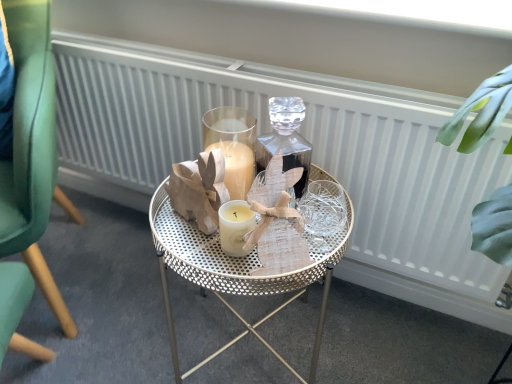
Question: Can you confirm if metallic gold table at center is thinner than green velvet chair at left?

Choices:
 (A) yes
 (B) no

Answer: (A)

Question: Is metallic gold table at center in front of green velvet chair at left?

Choices:
 (A) yes
 (B) no

Answer: (B)

Question: From the image's perspective, is metallic gold table at center below green velvet chair at left?

Choices:
 (A) no
 (B) yes

Answer: (B)

Question: Is metallic gold table at center with green velvet chair at left?

Choices:
 (A) no
 (B) yes

Answer: (A)

Question: Can we say metallic gold table at center lies outside green velvet chair at left?

Choices:
 (A) no
 (B) yes

Answer: (B)

Question: Considering the relative sizes of metallic gold table at center and green velvet chair at left in the image provided, is metallic gold table at center shorter than green velvet chair at left?

Choices:
 (A) no
 (B) yes

Answer: (B)

Question: Is green velvet chair at left shorter than white textured radiator at center?

Choices:
 (A) yes
 (B) no

Answer: (B)

Question: From the image's perspective, is green velvet chair at left on white textured radiator at center?

Choices:
 (A) yes
 (B) no

Answer: (A)

Question: Can you confirm if green velvet chair at left is smaller than white textured radiator at center?

Choices:
 (A) no
 (B) yes

Answer: (A)

Question: From the image's perspective, is green velvet chair at left under white textured radiator at center?

Choices:
 (A) no
 (B) yes

Answer: (A)

Question: Is green velvet chair at left at the left side of white textured radiator at center?

Choices:
 (A) yes
 (B) no

Answer: (A)

Question: Could you tell me if green velvet chair at left is facing white textured radiator at center?

Choices:
 (A) no
 (B) yes

Answer: (A)

Question: Would you consider green velvet chair at left to be distant from metallic gold table at center?

Choices:
 (A) no
 (B) yes

Answer: (A)